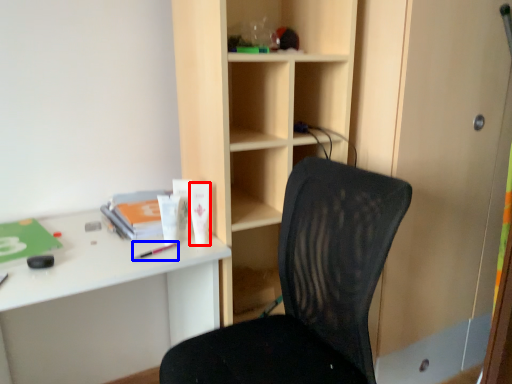
Question: Which of the following is the closest to the observer, stationery (highlighted by a red box) or stationery (highlighted by a blue box)?

Choices:
 (A) stationery
 (B) stationery

Answer: (B)